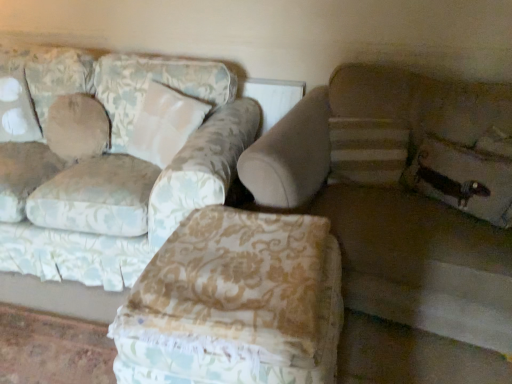
Question: Is floral fabric pillow at lower right, which is counted as the 2th pillow, starting from the left, positioned beyond the bounds of floral fabric ottoman at center?

Choices:
 (A) yes
 (B) no

Answer: (A)

Question: From a real-world perspective, is floral fabric pillow at lower right, which is counted as the 2th pillow, starting from the left, on top of floral fabric ottoman at center?

Choices:
 (A) yes
 (B) no

Answer: (A)

Question: Can you confirm if floral fabric pillow at lower right, which ranks as the first pillow in right-to-left order, is wider than floral fabric ottoman at center?

Choices:
 (A) yes
 (B) no

Answer: (B)

Question: Is floral fabric pillow at lower right, which ranks as the first pillow in right-to-left order, taller than floral fabric ottoman at center?

Choices:
 (A) yes
 (B) no

Answer: (B)

Question: Is floral fabric pillow at lower right, the first pillow viewed from the front, to the right of floral fabric ottoman at center from the viewer's perspective?

Choices:
 (A) no
 (B) yes

Answer: (B)

Question: Is floral fabric pillow at lower right, the 2th pillow viewed from the back, not near floral fabric ottoman at center?

Choices:
 (A) no
 (B) yes

Answer: (A)

Question: Considering the relative sizes of floral fabric couch at left, which appears as the 1th studio couch when viewed from the left, and floral fabric pillow at lower right, the 2th pillow viewed from the back, in the image provided, is floral fabric couch at left, which appears as the 1th studio couch when viewed from the left, bigger than floral fabric pillow at lower right, the 2th pillow viewed from the back,?

Choices:
 (A) no
 (B) yes

Answer: (B)

Question: From a real-world perspective, is floral fabric couch at left, which appears as the 1th studio couch when viewed from the left, positioned under floral fabric pillow at lower right, the 2th pillow viewed from the back, based on gravity?

Choices:
 (A) no
 (B) yes

Answer: (B)

Question: Could floral fabric pillow at lower right, the first pillow viewed from the front, be considered to be inside floral fabric couch at left, the 2th studio couch in the right-to-left sequence?

Choices:
 (A) yes
 (B) no

Answer: (B)

Question: Can you confirm if floral fabric couch at left, the 2th studio couch in the right-to-left sequence, is smaller than floral fabric pillow at lower right, which ranks as the first pillow in right-to-left order?

Choices:
 (A) no
 (B) yes

Answer: (A)

Question: Does floral fabric couch at left, the 2th studio couch in the right-to-left sequence, lie behind floral fabric pillow at lower right, the first pillow viewed from the front?

Choices:
 (A) yes
 (B) no

Answer: (B)

Question: From the image's perspective, is floral fabric couch at left, the 2th studio couch in the right-to-left sequence, below floral fabric pillow at lower right, which is counted as the 2th pillow, starting from the left?

Choices:
 (A) no
 (B) yes

Answer: (A)

Question: Is beige fabric pillow at upper left, arranged as the 2th pillow when viewed from the right, turned away from floral fabric ottoman at center?

Choices:
 (A) yes
 (B) no

Answer: (B)